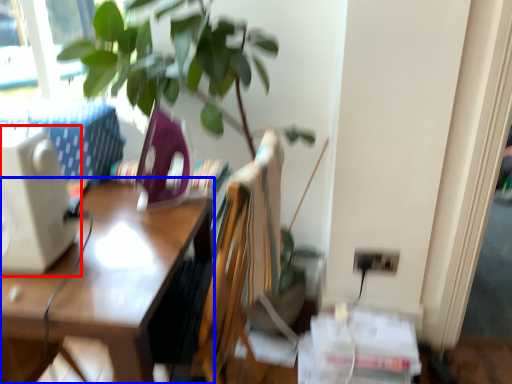
Question: Among these objects, which one is farthest to the camera, desktop computer (highlighted by a red box) or desk (highlighted by a blue box)?

Choices:
 (A) desktop computer
 (B) desk

Answer: (A)